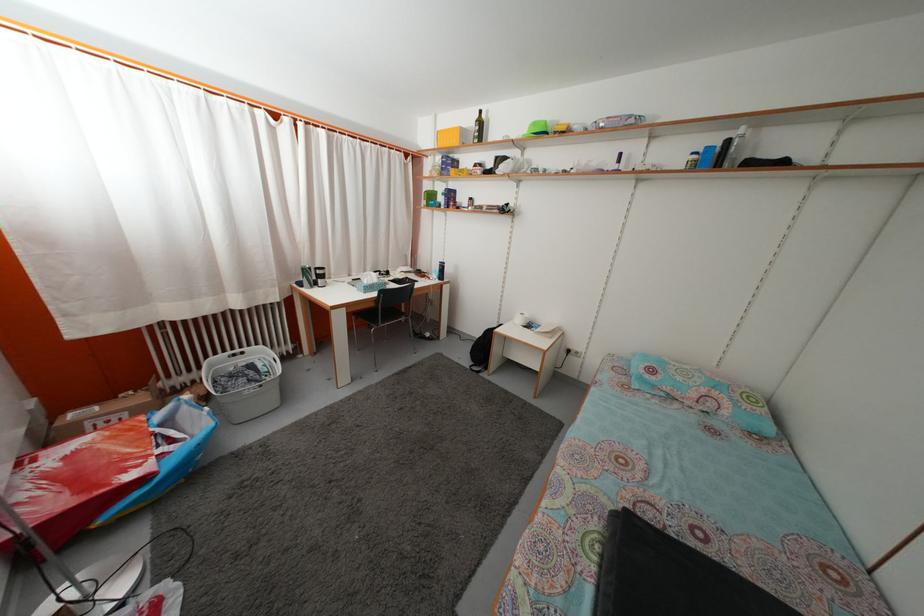
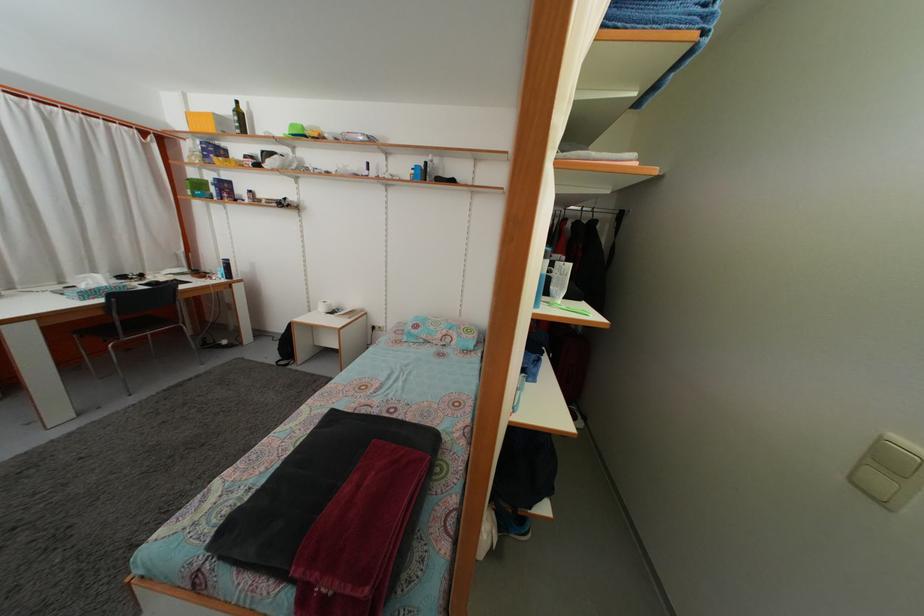
In the second image, find the point that corresponds to [540,131] in the first image.

(298, 132)